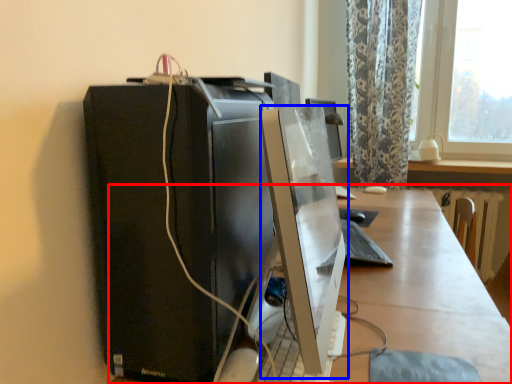
Question: Which object is further to the camera taking this photo, desk (highlighted by a red box) or computer monitor (highlighted by a blue box)?

Choices:
 (A) desk
 (B) computer monitor

Answer: (A)